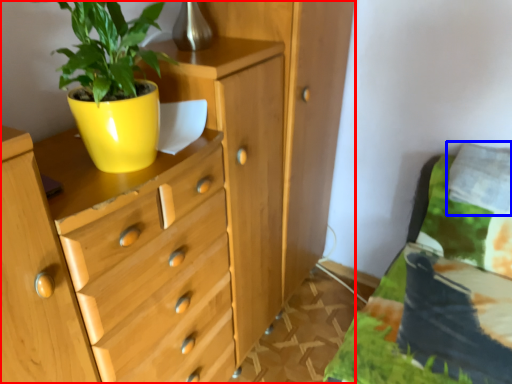
Question: Which object appears closest to the camera in this image, chest of drawers (highlighted by a red box) or pillow (highlighted by a blue box)?

Choices:
 (A) chest of drawers
 (B) pillow

Answer: (A)